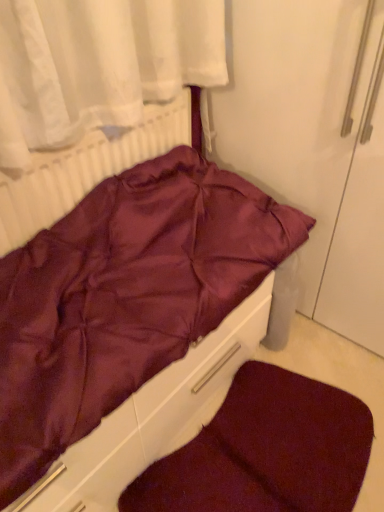
The image size is (384, 512). Describe the element at coordinates (85, 170) in the screenshot. I see `white textured radiator at upper left` at that location.

The width and height of the screenshot is (384, 512). Describe the element at coordinates (131, 322) in the screenshot. I see `burgundy satin bed at center` at that location.

What is the approximate height of burgundy satin bed at center?

burgundy satin bed at center is 7.64 inches in height.

Image resolution: width=384 pixels, height=512 pixels. What are the coordinates of `white textured radiator at upper left` in the screenshot? It's located at (85, 170).

From the image's perspective, between white textured radiator at upper left and burgundy plush dog bed at lower center, which one is located above?

From the image's view, white textured radiator at upper left is above.

Can you see white textured radiator at upper left touching burgundy plush dog bed at lower center?

white textured radiator at upper left and burgundy plush dog bed at lower center are clearly separated.

Considering the relative sizes of white textured radiator at upper left and burgundy plush dog bed at lower center in the image provided, is white textured radiator at upper left smaller than burgundy plush dog bed at lower center?

Actually, white textured radiator at upper left might be larger than burgundy plush dog bed at lower center.

From the image's perspective, is burgundy plush dog bed at lower center positioned above or below white textured radiator at upper left?

Clearly, from the image's perspective, burgundy plush dog bed at lower center is below white textured radiator at upper left.

From a real-world perspective, is burgundy plush dog bed at lower center on top of white textured radiator at upper left?

No, from a real-world perspective, burgundy plush dog bed at lower center is not above white textured radiator at upper left.

Can you confirm if burgundy plush dog bed at lower center is positioned to the right of white textured radiator at upper left?

Yes.

Locate an element on the screen. The image size is (384, 512). dog bed behind the white textured radiator at upper left is located at coordinates (265, 451).

Which object is wider, white textured radiator at upper left or burgundy satin bed at center?

Wider between the two is burgundy satin bed at center.

Based on the photo, from the image's perspective, who appears lower, white textured radiator at upper left or burgundy satin bed at center?

From the image's view, burgundy satin bed at center is below.

Is white textured radiator at upper left inside the boundaries of burgundy satin bed at center, or outside?

white textured radiator at upper left is not enclosed by burgundy satin bed at center.

From a real-world perspective, who is located higher, white textured radiator at upper left or burgundy satin bed at center?

white textured radiator at upper left.

Are burgundy satin bed at center and burgundy plush dog bed at lower center beside each other?

No, burgundy satin bed at center is not in contact with burgundy plush dog bed at lower center.

Does burgundy satin bed at center appear on the right side of burgundy plush dog bed at lower center?

No, burgundy satin bed at center is not to the right of burgundy plush dog bed at lower center.

From a real-world perspective, which is physically above, burgundy satin bed at center or burgundy plush dog bed at lower center?

burgundy satin bed at center, from a real-world perspective.

Can you confirm if burgundy plush dog bed at lower center is positioned to the left of burgundy satin bed at center?

No, burgundy plush dog bed at lower center is not to the left of burgundy satin bed at center.

Between burgundy plush dog bed at lower center and burgundy satin bed at center, which one has smaller width?

burgundy satin bed at center.

Can you see burgundy plush dog bed at lower center touching burgundy satin bed at center?

burgundy plush dog bed at lower center and burgundy satin bed at center are clearly separated.

Considering the sizes of objects burgundy plush dog bed at lower center and burgundy satin bed at center in the image provided, who is smaller, burgundy plush dog bed at lower center or burgundy satin bed at center?

burgundy plush dog bed at lower center is smaller.

From the image's perspective, is burgundy satin bed at center located above or below white textured radiator at upper left?

Clearly, from the image's perspective, burgundy satin bed at center is below white textured radiator at upper left.

Does burgundy satin bed at center lie in front of white textured radiator at upper left?

Yes.

Is burgundy satin bed at center oriented towards white textured radiator at upper left?

No.

Find the location of `dog bed below the white textured radiator at upper left (from the image's perspective)`. dog bed below the white textured radiator at upper left (from the image's perspective) is located at coordinates (x=265, y=451).

Find the location of `radiator located in front of the burgundy plush dog bed at lower center`. radiator located in front of the burgundy plush dog bed at lower center is located at coordinates (85, 170).

From the picture: Looking at the image, which one is located further to burgundy satin bed at center, burgundy plush dog bed at lower center or white textured radiator at upper left?

burgundy plush dog bed at lower center lies further to burgundy satin bed at center than the other object.

When comparing their distances from burgundy plush dog bed at lower center, does white textured radiator at upper left or burgundy satin bed at center seem closer?

burgundy satin bed at center is positioned closer to the anchor burgundy plush dog bed at lower center.

Which object lies nearer to the anchor point white textured radiator at upper left, burgundy satin bed at center or burgundy plush dog bed at lower center?

burgundy satin bed at center is positioned closer to the anchor white textured radiator at upper left.

Considering their positions, is burgundy plush dog bed at lower center positioned further to white textured radiator at upper left than burgundy satin bed at center?

The object further to white textured radiator at upper left is burgundy plush dog bed at lower center.

Looking at the image, which one is located closer to burgundy satin bed at center, white textured radiator at upper left or burgundy plush dog bed at lower center?

white textured radiator at upper left is closer to burgundy satin bed at center.

Which object lies further to the anchor point burgundy plush dog bed at lower center, burgundy satin bed at center or white textured radiator at upper left?

white textured radiator at upper left is positioned further to the anchor burgundy plush dog bed at lower center.

The image size is (384, 512). What are the coordinates of `furniture that lies between white textured radiator at upper left and burgundy plush dog bed at lower center from top to bottom` in the screenshot? It's located at (131, 322).